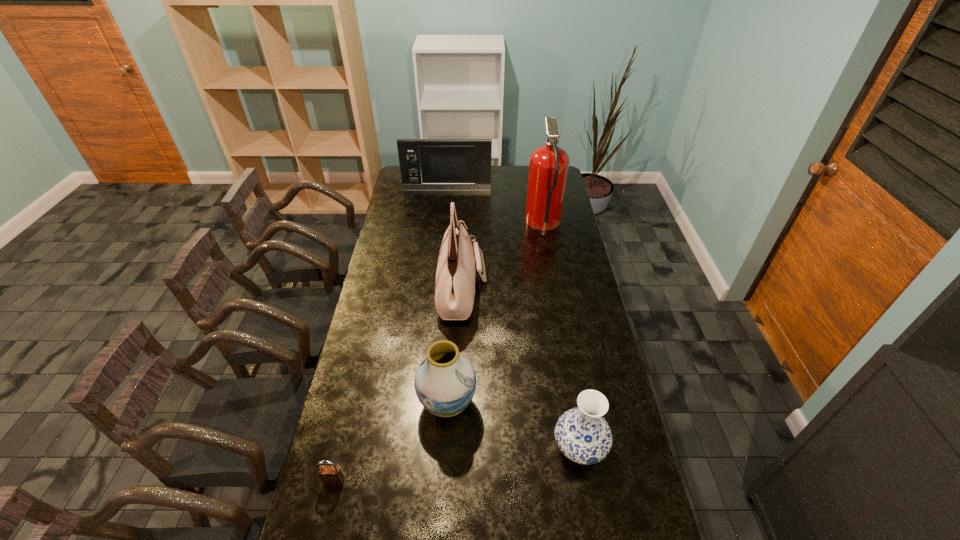
At what (x,y) coordinates should I click in order to perform the action: click on fire extinguisher. Please return your answer as a coordinate pair (x, y). Looking at the image, I should click on (549, 164).

In order to click on handbag in this screenshot , I will do `click(455, 276)`.

I want to click on the farthest object, so click(x=426, y=164).

Identify the location of the left vase. (445, 382).

Find the location of a particular element. The height and width of the screenshot is (540, 960). the right vase is located at coordinates (582, 434).

The image size is (960, 540). I want to click on padlock, so click(332, 474).

This screenshot has height=540, width=960. Identify the location of the shortest object. pos(332,474).

At what (x,y) coordinates should I click in order to perform the action: click on vacant space situated 0.100m with the handle and nozzle on the fifth nearest object. Please return your answer as a coordinate pair (x, y). Looking at the image, I should click on 505,225.

This screenshot has height=540, width=960. Find the location of `free spot located with the handle and nozzle on the fifth nearest object`. free spot located with the handle and nozzle on the fifth nearest object is located at coordinates (446, 225).

Locate an element on the screen. Image resolution: width=960 pixels, height=540 pixels. free space located with the handle and nozzle on the fifth nearest object is located at coordinates (481, 225).